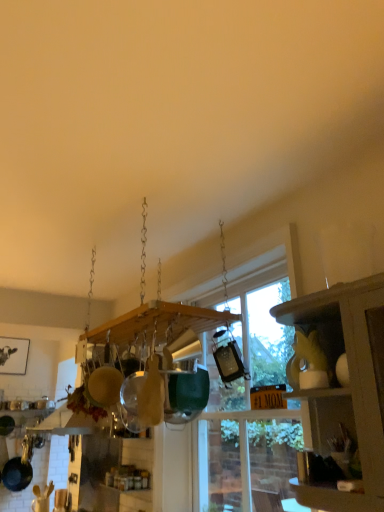
What do you see at coordinates (19, 468) in the screenshot?
I see `black matte frying pan at lower left` at bounding box center [19, 468].

Find the location of a particular element. matte yellow cabinet at right is located at coordinates (345, 387).

This screenshot has width=384, height=512. In order to click on black matte frying pan at lower left in this screenshot , I will do `click(19, 468)`.

Which is more to the left, black matte frying pan at lower left or matte yellow cabinet at right?

black matte frying pan at lower left.

Considering the points (2, 472) and (352, 310), which point is in front, point (2, 472) or point (352, 310)?

Point (352, 310)

Can you see black matte frying pan at lower left touching matte yellow cabinet at right?

No, black matte frying pan at lower left is not beside matte yellow cabinet at right.

Would you say black matte frying pan at lower left is outside matte yellow cabinet at right?

That's correct, black matte frying pan at lower left is outside of matte yellow cabinet at right.

In the scene shown: Is the depth of black matte frying pan at lower left less than that of transparent glass window at center?

No, it is not.

Would you say black matte frying pan at lower left is to the left or to the right of transparent glass window at center in the picture?

black matte frying pan at lower left is to the left of transparent glass window at center.

Between black matte frying pan at lower left and transparent glass window at center, which one has smaller width?

With smaller width is black matte frying pan at lower left.

Considering the sizes of objects black matte frying pan at lower left and transparent glass window at center in the image provided, who is taller, black matte frying pan at lower left or transparent glass window at center?

transparent glass window at center.

Considering the sizes of matte yellow cabinet at right and black matte frying pan at lower left in the image, is matte yellow cabinet at right taller or shorter than black matte frying pan at lower left?

matte yellow cabinet at right is taller than black matte frying pan at lower left.

Is matte yellow cabinet at right surrounding black matte frying pan at lower left?

No, black matte frying pan at lower left is not inside matte yellow cabinet at right.

Does matte yellow cabinet at right come behind black matte frying pan at lower left?

No.

Measure the distance from matte yellow cabinet at right to black matte frying pan at lower left.

A distance of 9.63 feet exists between matte yellow cabinet at right and black matte frying pan at lower left.

Is transparent glass window at center not near black matte frying pan at lower left?

transparent glass window at center is positioned a significant distance from black matte frying pan at lower left.

From the image's perspective, which one is positioned higher, transparent glass window at center or black matte frying pan at lower left?

From the image's view, transparent glass window at center is above.

Based on their sizes in the image, would you say transparent glass window at center is bigger or smaller than black matte frying pan at lower left?

In the image, transparent glass window at center appears to be larger than black matte frying pan at lower left.

Between transparent glass window at center and black matte frying pan at lower left, which one appears on the left side from the viewer's perspective?

black matte frying pan at lower left.

Considering the sizes of objects matte yellow cabinet at right and transparent glass window at center in the image provided, who is thinner, matte yellow cabinet at right or transparent glass window at center?

transparent glass window at center.

Does matte yellow cabinet at right appear on the right side of transparent glass window at center?

Indeed, matte yellow cabinet at right is positioned on the right side of transparent glass window at center.

From the image's perspective, which is below, matte yellow cabinet at right or transparent glass window at center?

transparent glass window at center appears lower in the image.

Would you say transparent glass window at center is a long distance from matte yellow cabinet at right?

No.

I want to click on window above the matte yellow cabinet at right (from a real-world perspective), so click(x=248, y=407).

Can you confirm if transparent glass window at center is smaller than matte yellow cabinet at right?

Incorrect, transparent glass window at center is not smaller in size than matte yellow cabinet at right.

Relative to matte yellow cabinet at right, is transparent glass window at center in front or behind?

transparent glass window at center is behind matte yellow cabinet at right.

At what (x,y) coordinates should I click in order to perform the action: click on cabinetry in front of the black matte frying pan at lower left. Please return your answer as a coordinate pair (x, y). The image size is (384, 512). Looking at the image, I should click on (345, 387).

Where is `frying pan on the left of transparent glass window at center`? The image size is (384, 512). frying pan on the left of transparent glass window at center is located at coordinates (19, 468).

From the image, which object appears to be nearer to transparent glass window at center, black matte frying pan at lower left or matte yellow cabinet at right?

Based on the image, matte yellow cabinet at right appears to be nearer to transparent glass window at center.

Which object lies nearer to the anchor point transparent glass window at center, matte yellow cabinet at right or black matte frying pan at lower left?

Based on the image, matte yellow cabinet at right appears to be nearer to transparent glass window at center.

Based on their spatial positions, is transparent glass window at center or black matte frying pan at lower left closer to matte yellow cabinet at right?

transparent glass window at center is closer to matte yellow cabinet at right.

From the image, which object appears to be nearer to matte yellow cabinet at right, black matte frying pan at lower left or transparent glass window at center?

Based on the image, transparent glass window at center appears to be nearer to matte yellow cabinet at right.

From the image, which object appears to be farther from black matte frying pan at lower left, transparent glass window at center or matte yellow cabinet at right?

matte yellow cabinet at right is further to black matte frying pan at lower left.

From the image, which object appears to be nearer to black matte frying pan at lower left, matte yellow cabinet at right or transparent glass window at center?

transparent glass window at center is closer to black matte frying pan at lower left.

Find the location of a particular element. This screenshot has height=512, width=384. window located between matte yellow cabinet at right and black matte frying pan at lower left in the depth direction is located at coordinates (248, 407).